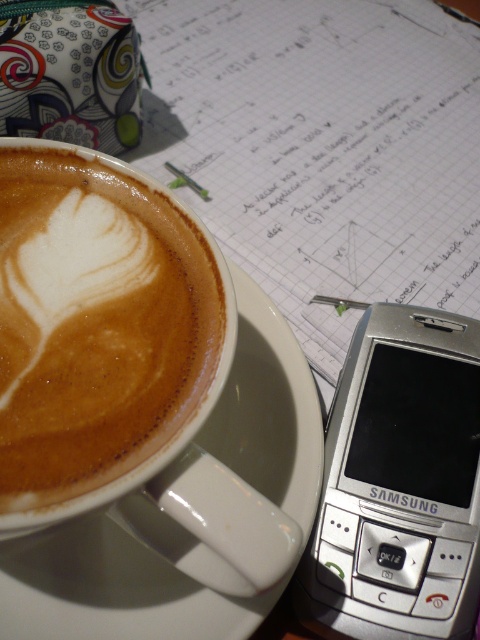
You are a barista arranging items on a counter. You have a white glossy saucer at upper center and a silver metallic samsung phone at upper right. According to the scene, which object is positioned to the left of the other?

The white glossy saucer at upper center is positioned to the left of the silver metallic samsung phone at upper right.

You are a barista who just prepared a latte in the white glossy saucer at upper center and the silver metallic samsung phone at upper right is on the counter. You need to place both items on a shelf that can only hold items up to 10 cm in height. Which item might not fit on the shelf?

The white glossy saucer at upper center is much taller than the silver metallic samsung phone at upper right. Since the saucer is taller, it might exceed the 10 cm height limit and not fit on the shelf.